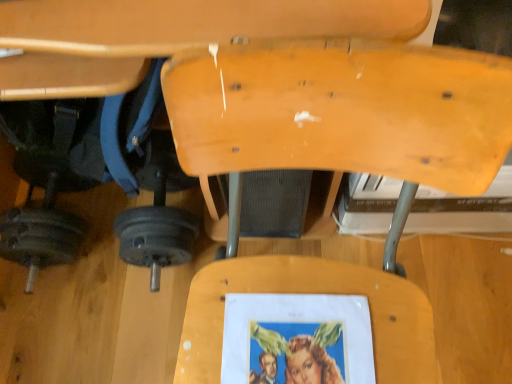
Question: Could you tell me if wooden swivel chair at center is turned towards dark gray metallic barbell at lower left?

Choices:
 (A) yes
 (B) no

Answer: (A)

Question: Is dark gray metallic barbell at lower left at the back of wooden swivel chair at center?

Choices:
 (A) no
 (B) yes

Answer: (A)

Question: Is wooden swivel chair at center further to camera compared to dark gray metallic barbell at lower left?

Choices:
 (A) yes
 (B) no

Answer: (B)

Question: Is wooden swivel chair at center positioned far away from dark gray metallic barbell at lower left?

Choices:
 (A) no
 (B) yes

Answer: (A)

Question: Is wooden swivel chair at center positioned in front of dark gray metallic barbell at lower left?

Choices:
 (A) no
 (B) yes

Answer: (B)

Question: Can you confirm if wooden swivel chair at center is positioned to the right of dark gray metallic barbell at lower left?

Choices:
 (A) no
 (B) yes

Answer: (B)

Question: Considering the relative sizes of dark gray metallic barbell at lower left and wooden swivel chair at center in the image provided, is dark gray metallic barbell at lower left shorter than wooden swivel chair at center?

Choices:
 (A) yes
 (B) no

Answer: (A)

Question: Is dark gray metallic barbell at lower left with wooden swivel chair at center?

Choices:
 (A) yes
 (B) no

Answer: (B)

Question: From a real-world perspective, is dark gray metallic barbell at lower left physically below wooden swivel chair at center?

Choices:
 (A) yes
 (B) no

Answer: (A)

Question: Is dark gray metallic barbell at lower left smaller than wooden swivel chair at center?

Choices:
 (A) yes
 (B) no

Answer: (A)

Question: From the image's perspective, would you say dark gray metallic barbell at lower left is shown under wooden swivel chair at center?

Choices:
 (A) yes
 (B) no

Answer: (A)

Question: Is dark gray metallic barbell at lower left positioned beyond the bounds of wooden swivel chair at center?

Choices:
 (A) no
 (B) yes

Answer: (A)

Question: In the image, is wooden swivel chair at center on the left side or the right side of dark gray metallic barbell at lower left?

Choices:
 (A) left
 (B) right

Answer: (B)